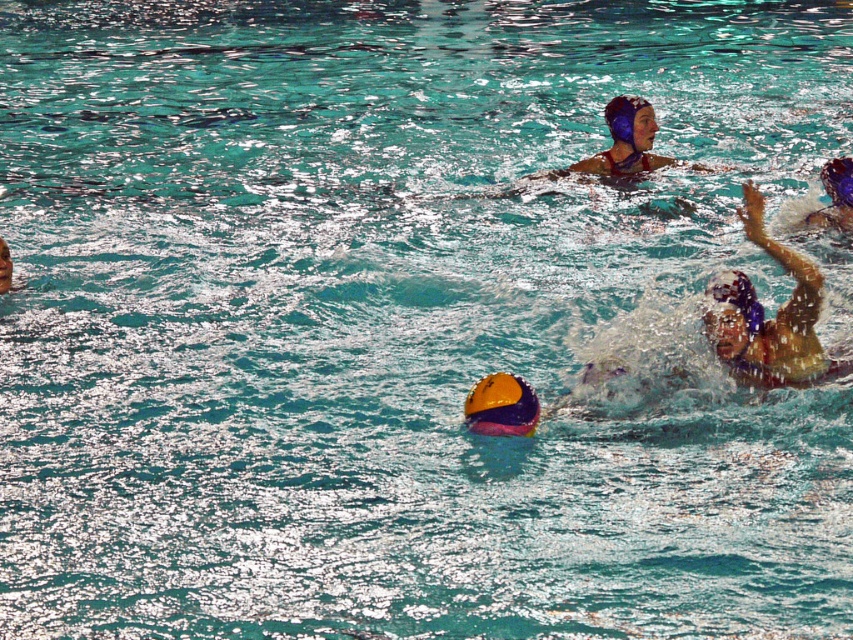
You are a referee observing the water polo match. You notice two items floating in the pool near the surface. The first is the yellow and purple helmet at lower right, and the second is the blue glossy swim cap at upper right. Which of these items is bigger in size?

The yellow and purple helmet at lower right has a larger size compared to the blue glossy swim cap at upper right, so the yellow and purple helmet at lower right is bigger.